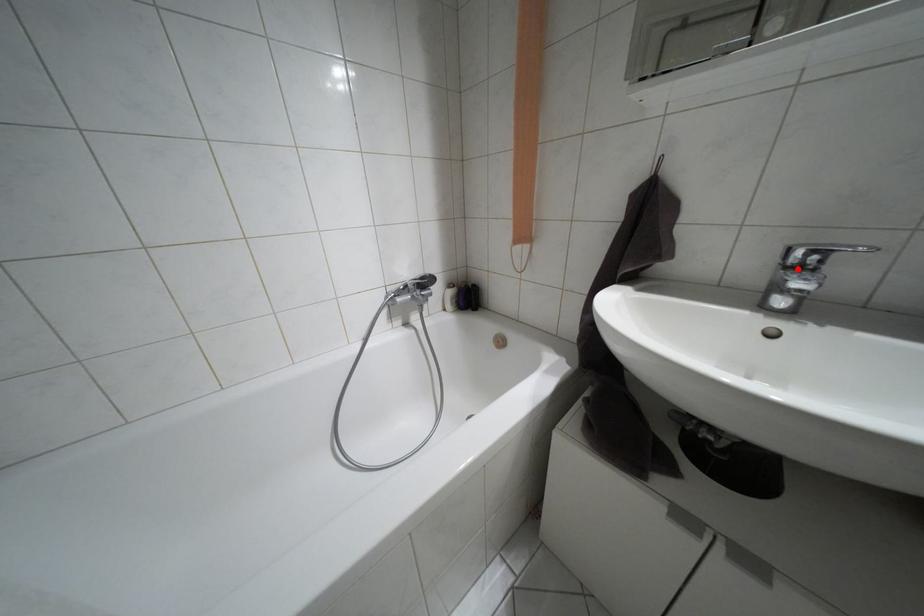
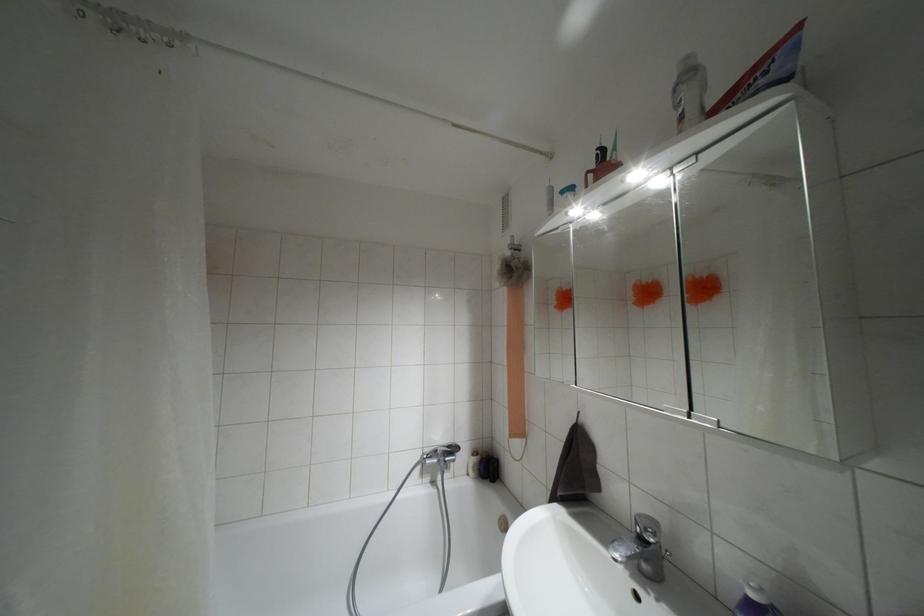
Find the pixel in the second image that matches the highlighted location in the first image.

(641, 538)